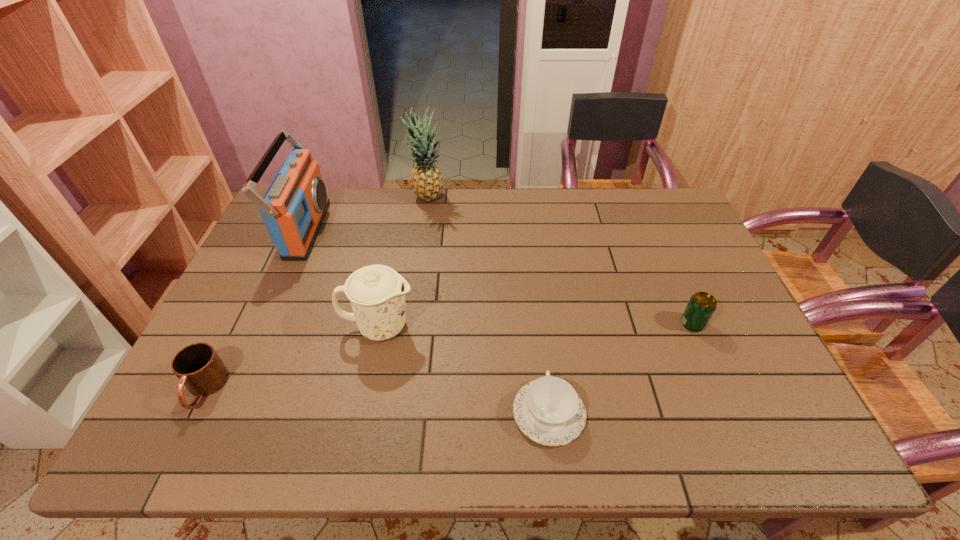
You are a GUI agent. You are given a task and a screenshot of the screen. Output one action in this format:
    pyautogui.click(x=<x>, y=<y>)
    Task: Click on the radio receiver situated at the left edge
    
    Given the screenshot: What is the action you would take?
    pyautogui.click(x=293, y=208)

At what (x,y) coordinates should I click in order to perform the action: click on mug situated at the left edge. Please return your answer as a coordinate pair (x, y). Image resolution: width=960 pixels, height=540 pixels. Looking at the image, I should click on (199, 368).

Identify the location of object situated at the right edge. The height and width of the screenshot is (540, 960). (701, 306).

At what (x,y) coordinates should I click in order to perform the action: click on object present at the far left corner. Please return your answer as a coordinate pair (x, y). Looking at the image, I should click on (293, 208).

Where is `object that is positioned at the near left corner`? object that is positioned at the near left corner is located at coordinates (199, 368).

This screenshot has height=540, width=960. In order to click on vacant space at the far edge of the desktop in this screenshot , I will do `click(605, 217)`.

Locate an element on the screen. Image resolution: width=960 pixels, height=540 pixels. vacant space at the near edge is located at coordinates (686, 430).

In the image, there is a desktop. Where is `vacant space at the left edge`? The height and width of the screenshot is (540, 960). vacant space at the left edge is located at coordinates (292, 276).

The image size is (960, 540). In order to click on free space at the far right corner of the desktop in this screenshot , I will do `click(662, 199)`.

In order to click on vacant space in between the tallest object and the rightmost object in this screenshot , I will do `click(560, 261)`.